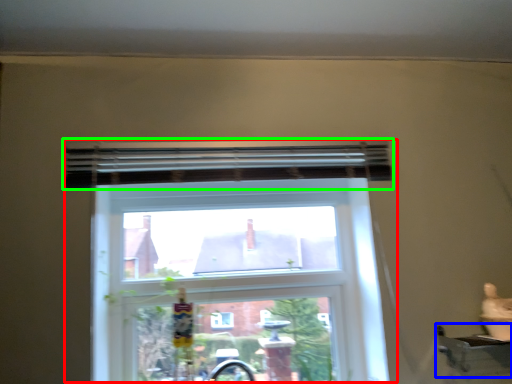
Question: Which is nearer to the window (highlighted by a red box)? window sill (highlighted by a blue box) or curtain (highlighted by a green box).

Choices:
 (A) window sill
 (B) curtain

Answer: (B)